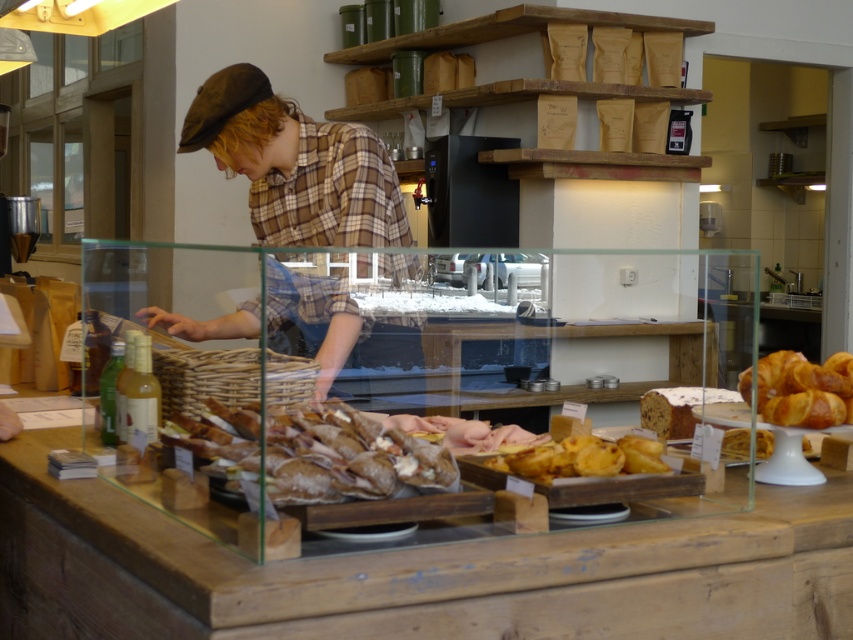
Question: Is golden flaky croissant at upper right to the right of golden brown pastry at center from the viewer's perspective?

Choices:
 (A) yes
 (B) no

Answer: (A)

Question: Which point is farther from the camera taking this photo?

Choices:
 (A) (277, 106)
 (B) (758, 410)

Answer: (A)

Question: Which of the following is the farthest from the observer?

Choices:
 (A) golden brown pastry at center
 (B) spongy brown bread at center

Answer: (B)

Question: Can you confirm if brown plaid shirt at center is positioned to the left of slightly toasted bread at center?

Choices:
 (A) yes
 (B) no

Answer: (A)

Question: Where is brown plaid shirt at center located in relation to slightly toasted bread at center in the image?

Choices:
 (A) above
 (B) below

Answer: (A)

Question: Which of the following is the farthest from the observer?

Choices:
 (A) (674, 413)
 (B) (772, 360)
 (C) (500, 468)

Answer: (A)